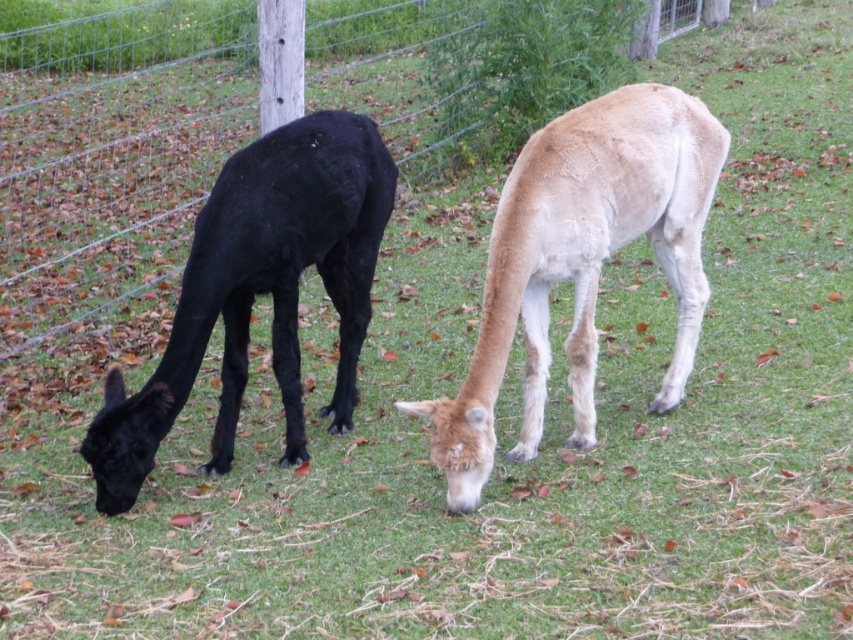
From the picture: Does light brown woolen alpaca at center appear under shiny black llama at left?

No, light brown woolen alpaca at center is not below shiny black llama at left.

The image size is (853, 640). In order to click on light brown woolen alpaca at center in this screenshot , I will do click(581, 262).